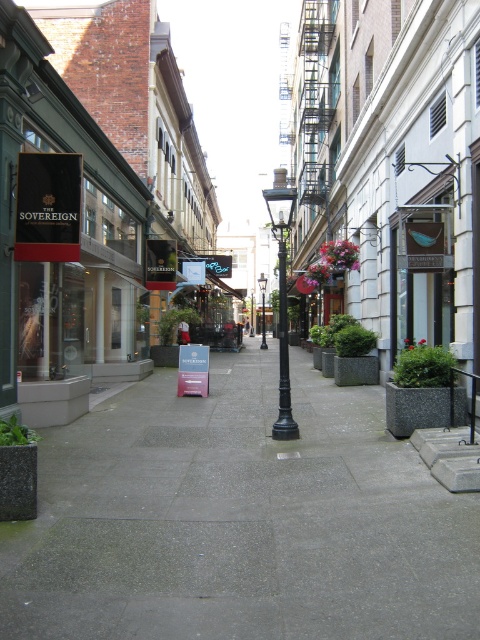
Question: Is gray concrete pavement at center to the right of black polished metal streetlight at center from the viewer's perspective?

Choices:
 (A) no
 (B) yes

Answer: (A)

Question: Can you confirm if gray concrete pavement at center is smaller than black metal lamp post at center?

Choices:
 (A) yes
 (B) no

Answer: (A)

Question: Is gray concrete pavement at center above black polished metal streetlight at center?

Choices:
 (A) yes
 (B) no

Answer: (B)

Question: Among these objects, which one is nearest to the camera?

Choices:
 (A) black metal lamp post at center
 (B) gray concrete pavement at center

Answer: (B)

Question: Based on their relative distances, which object is farther from the black metal lamp post at center?

Choices:
 (A) gray concrete pavement at center
 (B) black polished metal streetlight at center
 (C) black matte sign at upper left

Answer: (A)

Question: Which of the following is the closest to the observer?

Choices:
 (A) (66, 259)
 (B) (262, 305)
 (C) (189, 257)
 (D) (267, 211)

Answer: (A)